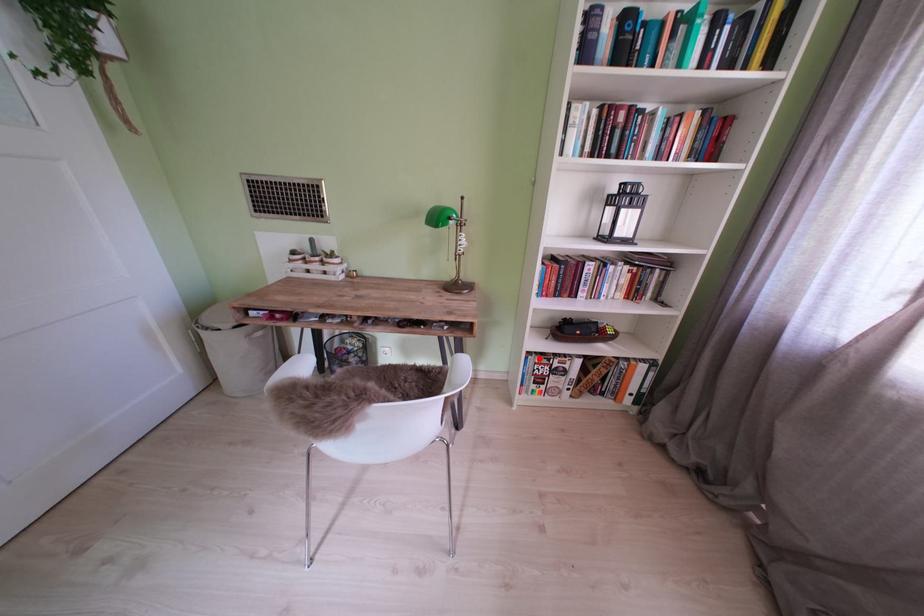
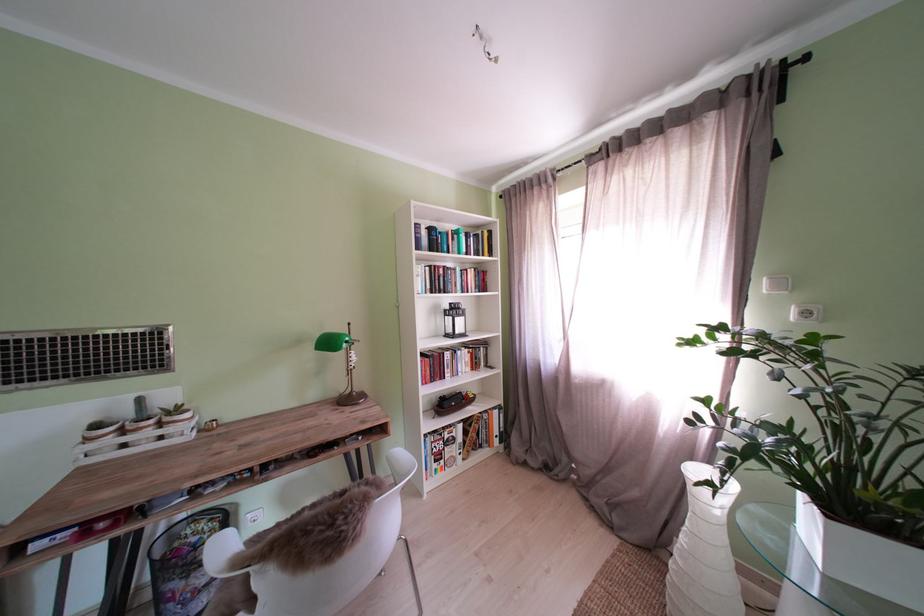
Locate, in the second image, the point that corresponds to the highlighted location in the first image.

(436, 440)